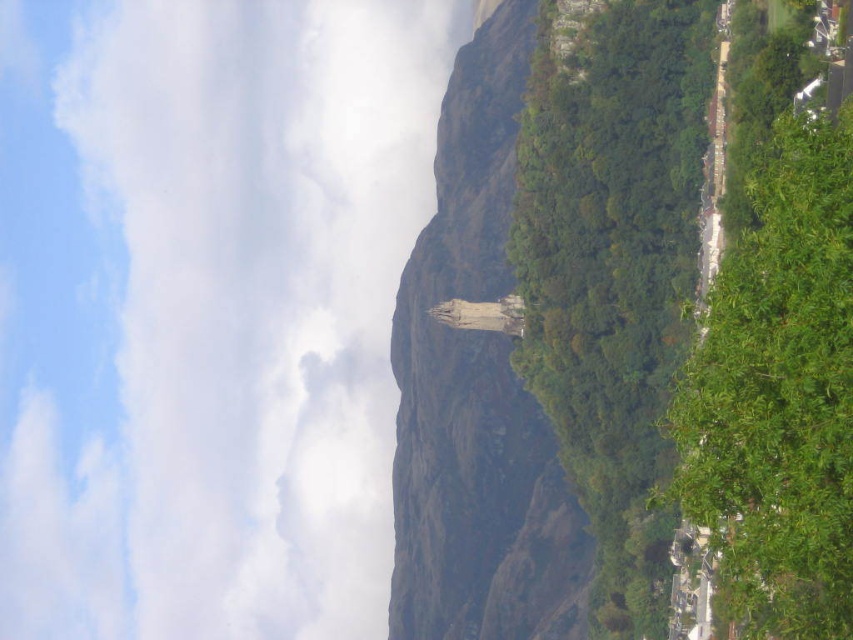
Question: Based on their relative distances, which object is nearer to the green leafy tree at right?

Choices:
 (A) green leafy tree at center
 (B) white fluffy cloud at upper center

Answer: (A)

Question: Is white fluffy cloud at upper center closer to camera compared to green leafy tree at center?

Choices:
 (A) yes
 (B) no

Answer: (B)

Question: Does green leafy tree at center come behind green leafy tree at right?

Choices:
 (A) yes
 (B) no

Answer: (A)

Question: Which point appears closest to the camera in this image?

Choices:
 (A) (54, 308)
 (B) (793, 410)
 (C) (631, 90)

Answer: (B)

Question: Estimate the real-world distances between objects in this image. Which object is closer to the white fluffy cloud at upper center?

Choices:
 (A) green leafy tree at center
 (B) green leafy tree at right

Answer: (A)

Question: Is white fluffy cloud at upper center closer to the viewer compared to green leafy tree at right?

Choices:
 (A) no
 (B) yes

Answer: (A)